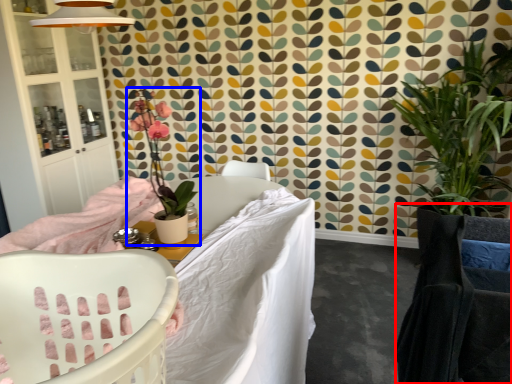
Question: Which point is closer to the camera, rocking chair (highlighted by a red box) or houseplant (highlighted by a blue box)?

Choices:
 (A) rocking chair
 (B) houseplant

Answer: (A)